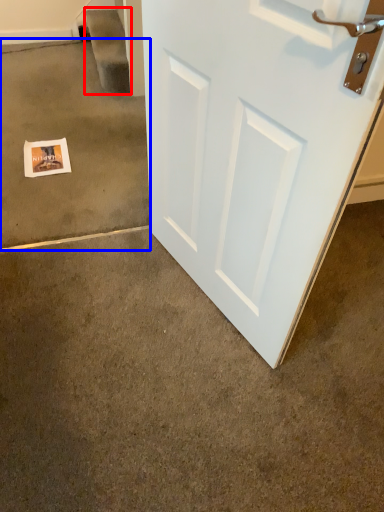
Question: Which object appears farthest to the camera in this image, stairwell (highlighted by a red box) or concrete (highlighted by a blue box)?

Choices:
 (A) stairwell
 (B) concrete

Answer: (A)